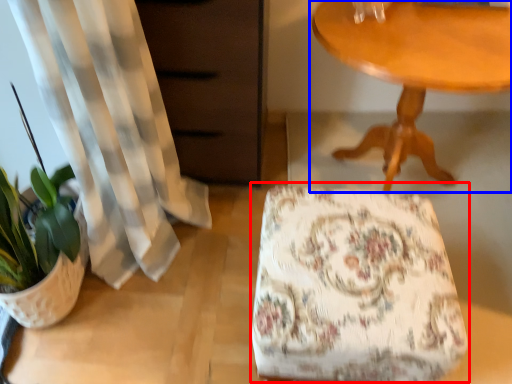
Question: Which point is closer to the camera, rocking chair (highlighted by a red box) or table (highlighted by a blue box)?

Choices:
 (A) rocking chair
 (B) table

Answer: (A)